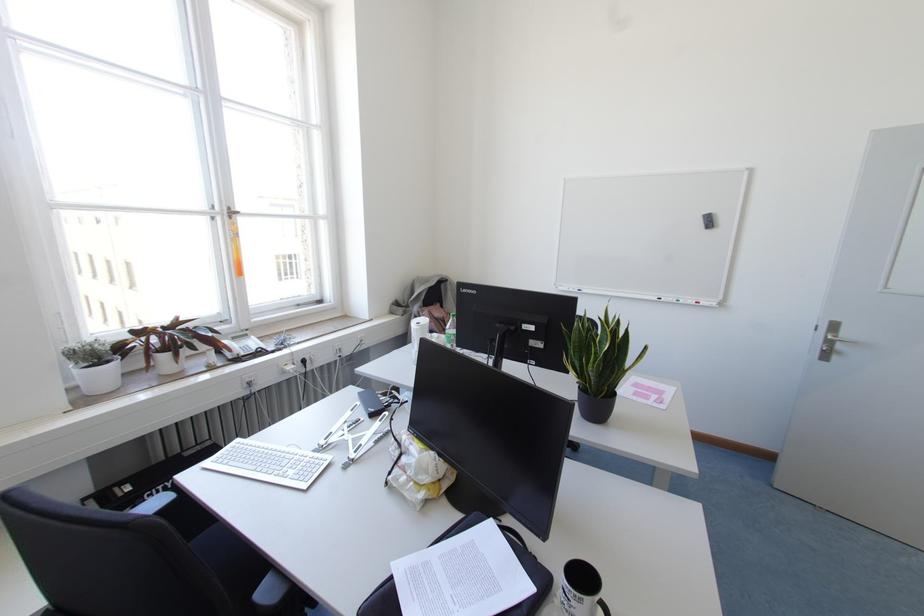
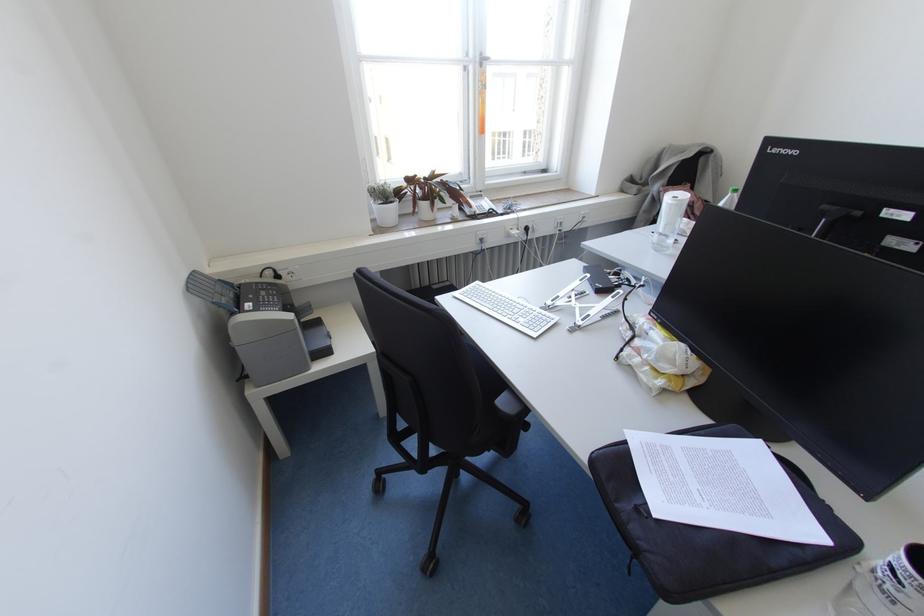
Locate, in the second image, the point that corresponds to point (497, 525) in the first image.

(762, 454)